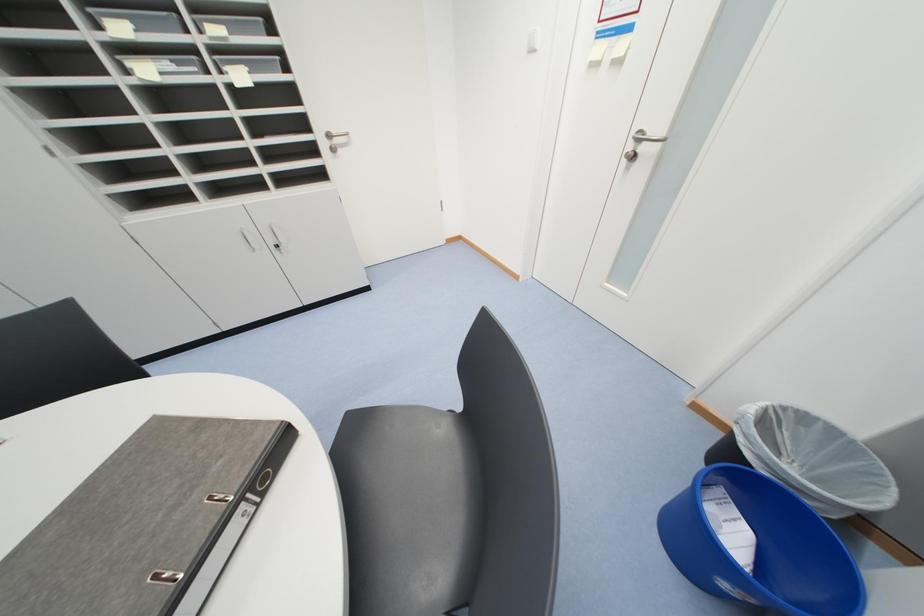
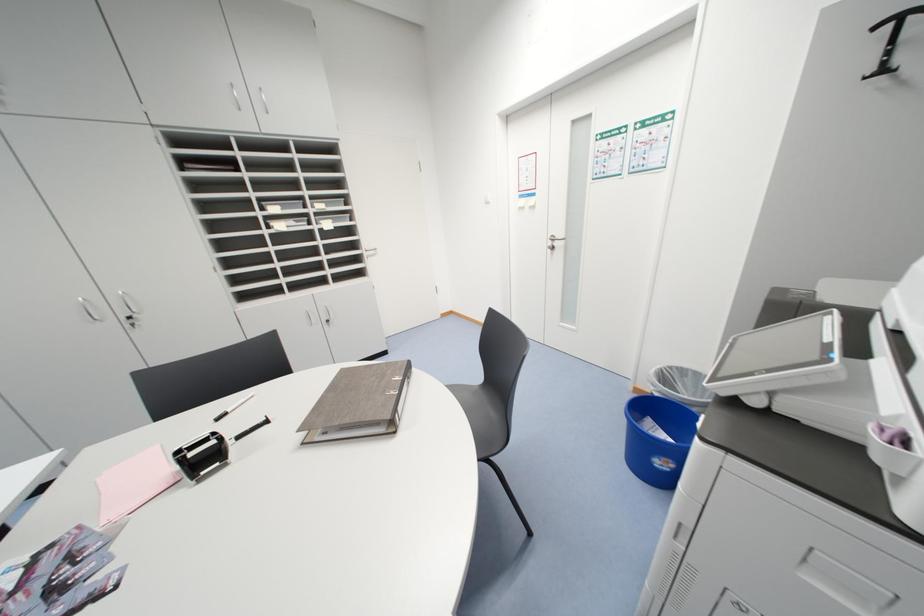
Question: The images are taken continuously from a first-person perspective. In which direction are you moving?

Choices:
 (A) Left
 (B) Right
 (C) Forward
 (D) Backward

Answer: (D)